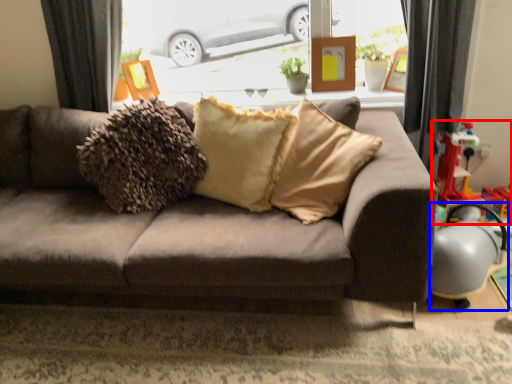
Question: Which object appears farthest to the camera in this image, toy (highlighted by a red box) or armchair (highlighted by a blue box)?

Choices:
 (A) toy
 (B) armchair

Answer: (A)